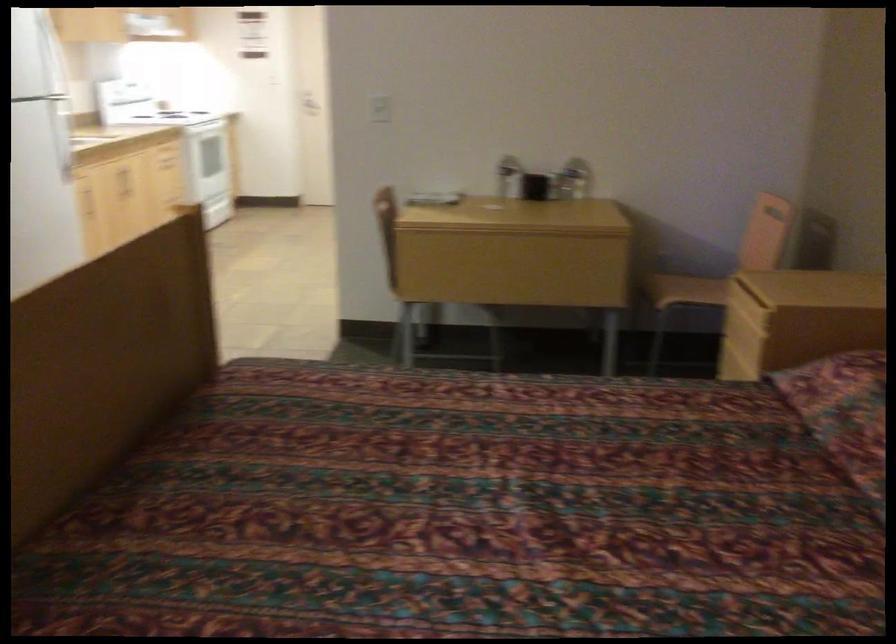
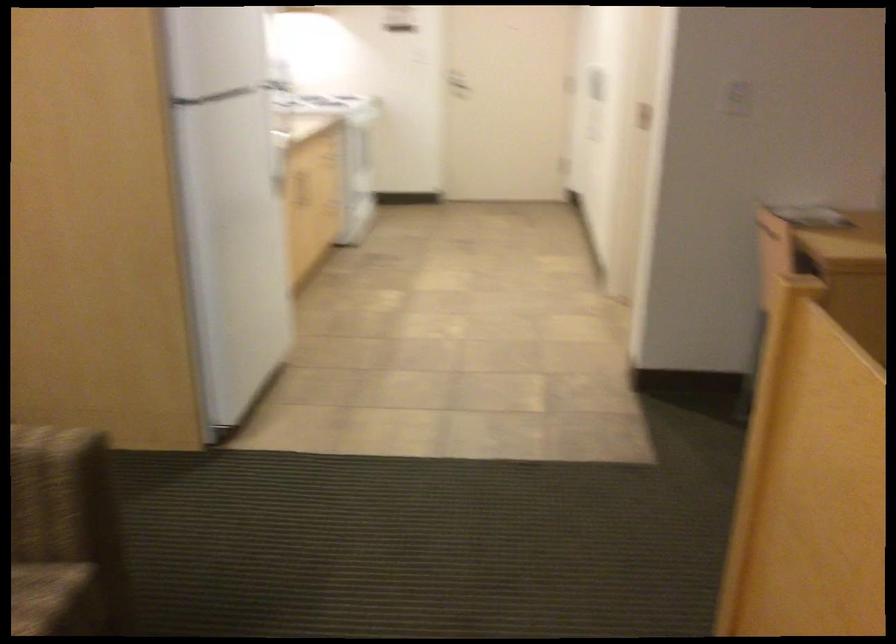
Locate, in the second image, the point that corresponds to [102,178] in the first image.

(297, 187)